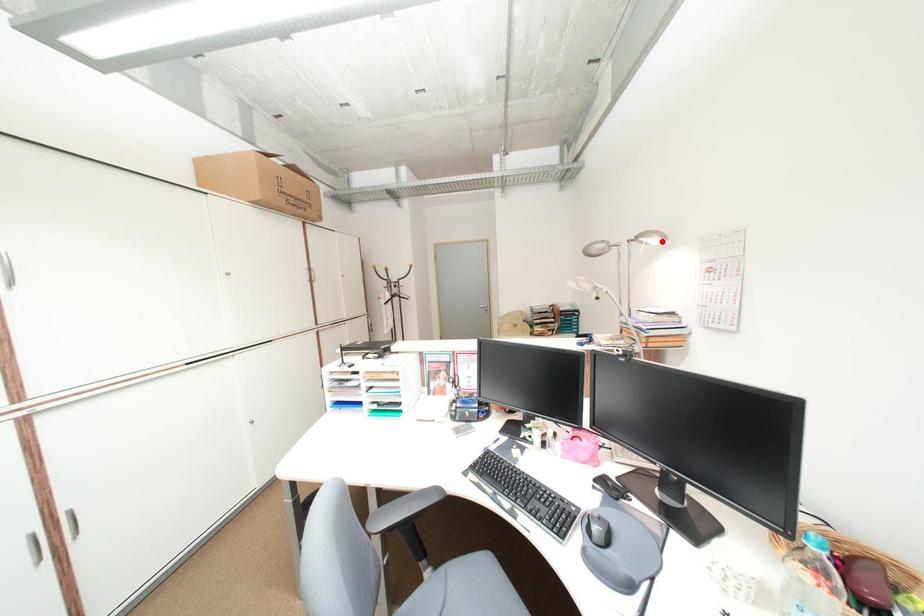
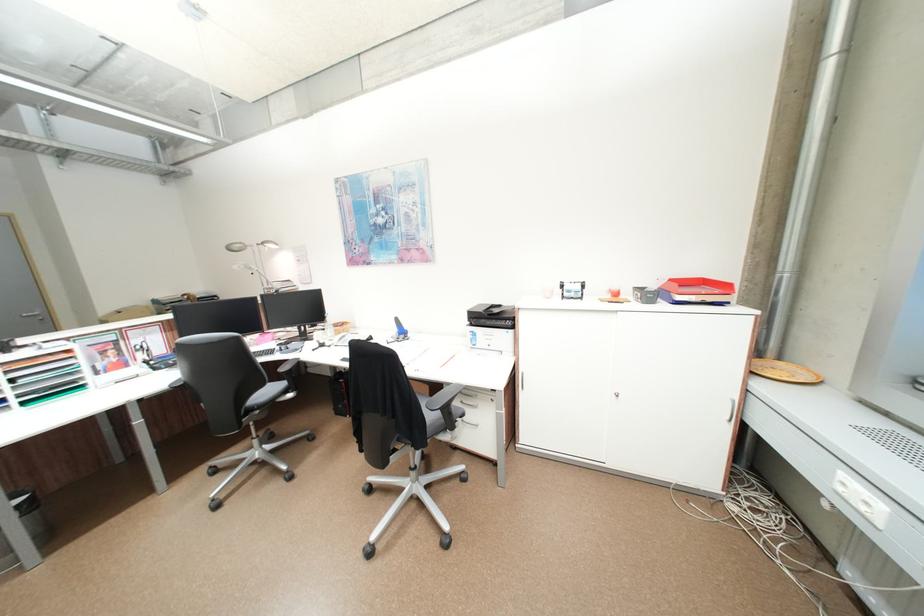
In the second image, find the point that corresponds to the highlighted location in the first image.

(281, 246)